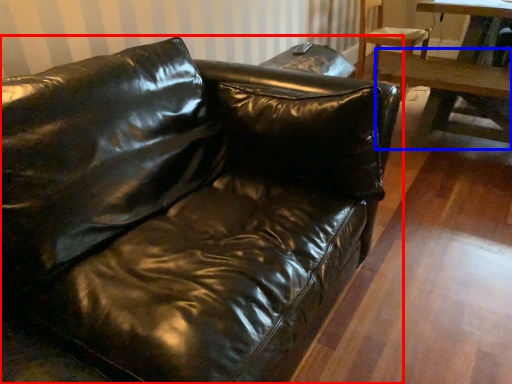
Question: Among these objects, which one is farthest to the camera, studio couch (highlighted by a red box) or table (highlighted by a blue box)?

Choices:
 (A) studio couch
 (B) table

Answer: (B)